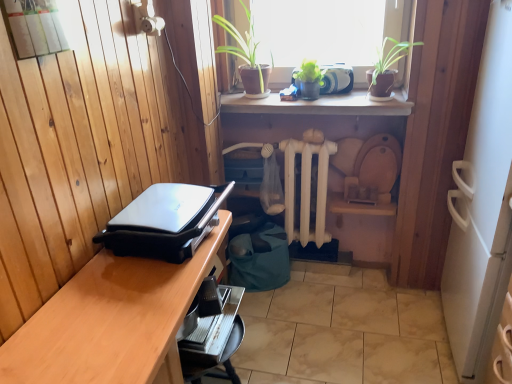
Question: From a real-world perspective, is green matte plant at upper center physically located above or below black plastic grill at left?

Choices:
 (A) below
 (B) above

Answer: (B)

Question: Is green matte plant at upper center inside the boundaries of black plastic grill at left, or outside?

Choices:
 (A) inside
 (B) outside

Answer: (B)

Question: Estimate the real-world distances between objects in this image. Which object is closer to the green matte plant at upper center?

Choices:
 (A) wooden desk at lower left
 (B) green matte plant at upper center
 (C) black plastic grill at left
 (D) green leafy plants at upper center
 (E) white wooden radiator at center

Answer: (D)

Question: Estimate the real-world distances between objects in this image. Which object is closer to the green leafy plants at upper center?

Choices:
 (A) black plastic grill at left
 (B) green matte plant at upper center
 (C) green matte plant at upper center
 (D) white wooden radiator at center
 (E) wooden desk at lower left

Answer: (B)